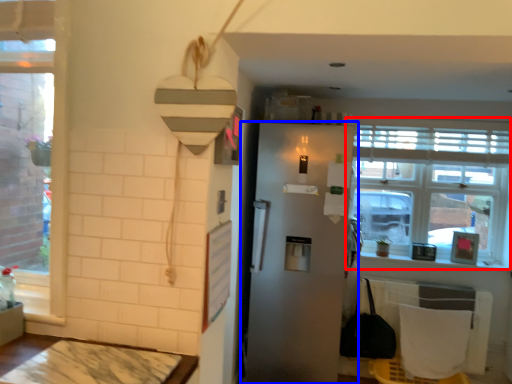
Question: Which point is further to the camera, window (highlighted by a red box) or refrigerator (highlighted by a blue box)?

Choices:
 (A) window
 (B) refrigerator

Answer: (A)